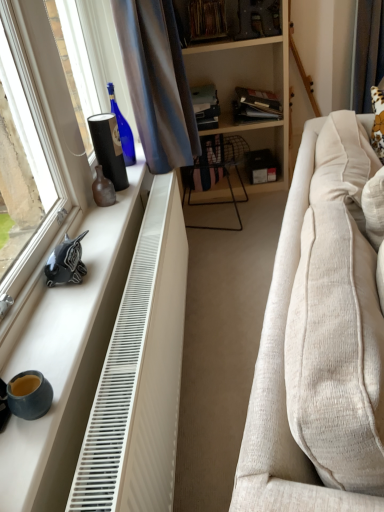
Find the location of a particular element. space that is in front of matte blue coffee cup at lower left is located at coordinates (22, 451).